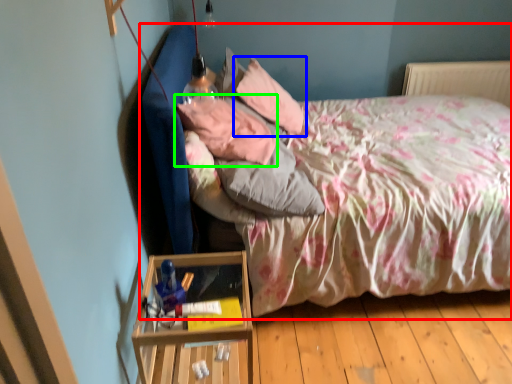
Question: Estimate the real-world distances between objects in this image. Which object is closer to bed (highlighted by a red box), pillow (highlighted by a blue box) or pillow (highlighted by a green box)?

Choices:
 (A) pillow
 (B) pillow

Answer: (B)